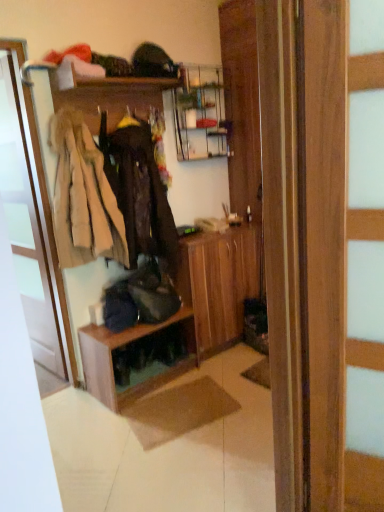
I want to click on white glossy door at left, so click(27, 227).

Identify the location of wooden dresser at center. (174, 314).

Where is `wooden shelf at center, the second shelf in the top-to-bottom sequence`? This screenshot has width=384, height=512. wooden shelf at center, the second shelf in the top-to-bottom sequence is located at coordinates (136, 358).

At what (x,y) coordinates should I click in order to perform the action: click on beige fur coat at left, placed as the 2th clothing when sorted from right to left. Please return your answer as a coordinate pair (x, y). The width and height of the screenshot is (384, 512). Looking at the image, I should click on (83, 196).

Looking at this image, is wooden dresser at center facing away from white glossy door at left?

Yes.

What are the coordinates of `door to the left of wooden dresser at center` in the screenshot? It's located at (27, 227).

From the image's perspective, is wooden dresser at center located above or below white glossy door at left?

Based on their image positions, wooden dresser at center is located beneath white glossy door at left.

Between wooden dresser at center and white glossy door at left, which one appears on the left side from the viewer's perspective?

white glossy door at left.

Based on the photo, is wooden coat rack at upper left, the 1th shelf positioned from the top, positioned with its back to white glossy door at left?

No, wooden coat rack at upper left, the 1th shelf positioned from the top, is not facing away from white glossy door at left.

Looking at this image, can we say wooden coat rack at upper left, acting as the 2th shelf starting from the bottom, lies outside white glossy door at left?

Yes, wooden coat rack at upper left, acting as the 2th shelf starting from the bottom, is outside of white glossy door at left.

Between wooden coat rack at upper left, the 1th shelf positioned from the top, and white glossy door at left, which one has more height?

Standing taller between the two is white glossy door at left.

Considering the positions of point (179, 82) and point (15, 225), is point (179, 82) closer or farther from the camera than point (15, 225)?

Point (179, 82) is positioned closer to the camera compared to point (15, 225).

From the image's perspective, is beige fur coat at left, the first clothing viewed from the left, above wooden dresser at center?

Indeed, from the image's perspective, beige fur coat at left, the first clothing viewed from the left, is shown above wooden dresser at center.

From a real-world perspective, which object stands above the other?

Result: beige fur coat at left, the first clothing viewed from the left, is physically above.

Is beige fur coat at left, the first clothing viewed from the left, not near wooden dresser at center?

That's not correct — beige fur coat at left, the first clothing viewed from the left, is a little close to wooden dresser at center.

Relative to wooden dresser at center, is beige fur coat at left, the first clothing viewed from the left, in front or behind?

In the image, beige fur coat at left, the first clothing viewed from the left, appears behind wooden dresser at center.

Considering the sizes of objects dark brown leather jacket at center, which ranks as the 1th clothing in right-to-left order, and beige fur coat at left, the first clothing viewed from the left, in the image provided, who is smaller, dark brown leather jacket at center, which ranks as the 1th clothing in right-to-left order, or beige fur coat at left, the first clothing viewed from the left,?

Smaller between the two is beige fur coat at left, the first clothing viewed from the left.

You are a GUI agent. You are given a task and a screenshot of the screen. Output one action in this format:
    pyautogui.click(x=<x>, y=<y>)
    Task: Click on the clothing located underneath the beige fur coat at left, placed as the 2th clothing when sorted from right to left (from a real-world perspective)
    The width and height of the screenshot is (384, 512).
    Given the screenshot: What is the action you would take?
    pyautogui.click(x=139, y=192)

Considering the relative sizes of dark brown leather jacket at center, which ranks as the 1th clothing in right-to-left order, and beige fur coat at left, the first clothing viewed from the left, in the image provided, is dark brown leather jacket at center, which ranks as the 1th clothing in right-to-left order, wider than beige fur coat at left, the first clothing viewed from the left,?

Yes.

From the picture: How much distance is there between white glossy door at left and beige fur coat at left, placed as the 2th clothing when sorted from right to left?

The distance of white glossy door at left from beige fur coat at left, placed as the 2th clothing when sorted from right to left, is 16.92 inches.

Considering the sizes of objects white glossy door at left and beige fur coat at left, the first clothing viewed from the left, in the image provided, who is shorter, white glossy door at left or beige fur coat at left, the first clothing viewed from the left,?

beige fur coat at left, the first clothing viewed from the left.

Which object is positioned more to the right, white glossy door at left or beige fur coat at left, placed as the 2th clothing when sorted from right to left?

beige fur coat at left, placed as the 2th clothing when sorted from right to left.

Is white glossy door at left not within beige fur coat at left, the first clothing viewed from the left?

Absolutely, white glossy door at left is external to beige fur coat at left, the first clothing viewed from the left.

Can you confirm if dark brown leather jacket at center, the second clothing when ordered from left to right, is taller than wooden coat rack at upper left, acting as the 2th shelf starting from the bottom?

Indeed, dark brown leather jacket at center, the second clothing when ordered from left to right, has a greater height compared to wooden coat rack at upper left, acting as the 2th shelf starting from the bottom.

From the image's perspective, is dark brown leather jacket at center, which ranks as the 1th clothing in right-to-left order, located above or below wooden coat rack at upper left, the 1th shelf positioned from the top?

dark brown leather jacket at center, which ranks as the 1th clothing in right-to-left order, is situated lower than wooden coat rack at upper left, the 1th shelf positioned from the top, in the image.

Is dark brown leather jacket at center, the second clothing when ordered from left to right, touching wooden coat rack at upper left, acting as the 2th shelf starting from the bottom?

No, dark brown leather jacket at center, the second clothing when ordered from left to right, is not making contact with wooden coat rack at upper left, acting as the 2th shelf starting from the bottom.

Which object is thinner, dark brown leather jacket at center, which ranks as the 1th clothing in right-to-left order, or wooden coat rack at upper left, acting as the 2th shelf starting from the bottom?

wooden coat rack at upper left, acting as the 2th shelf starting from the bottom.

Is beige fur coat at left, placed as the 2th clothing when sorted from right to left, not inside dark brown leather jacket at center, which ranks as the 1th clothing in right-to-left order?

beige fur coat at left, placed as the 2th clothing when sorted from right to left, lies outside dark brown leather jacket at center, which ranks as the 1th clothing in right-to-left order,'s area.

Based on the photo, in terms of width, does beige fur coat at left, the first clothing viewed from the left, look wider or thinner when compared to dark brown leather jacket at center, the second clothing when ordered from left to right?

In the image, beige fur coat at left, the first clothing viewed from the left, appears to be more narrow than dark brown leather jacket at center, the second clothing when ordered from left to right.

Would you consider beige fur coat at left, placed as the 2th clothing when sorted from right to left, to be distant from dark brown leather jacket at center, which ranks as the 1th clothing in right-to-left order?

No, beige fur coat at left, placed as the 2th clothing when sorted from right to left, is not far from dark brown leather jacket at center, which ranks as the 1th clothing in right-to-left order.

Identify the location of door on the left of the wooden dresser at center. The height and width of the screenshot is (512, 384). (27, 227).

At what (x,y) coordinates should I click in order to perform the action: click on door below the wooden coat rack at upper left, acting as the 2th shelf starting from the bottom (from the image's perspective). Please return your answer as a coordinate pair (x, y). Looking at the image, I should click on (27, 227).

Estimate the real-world distances between objects in this image. Which object is closer to white glossy door at left, wooden shelf at center, the 1th shelf positioned from the bottom, or beige fur coat at left, placed as the 2th clothing when sorted from right to left?

beige fur coat at left, placed as the 2th clothing when sorted from right to left, is positioned closer to the anchor white glossy door at left.

Estimate the real-world distances between objects in this image. Which object is closer to beige fur coat at left, the first clothing viewed from the left, wooden coat rack at upper left, the 1th shelf positioned from the top, or wooden dresser at center?

wooden dresser at center.

From the image, which object appears to be nearer to wooden coat rack at upper left, the 1th shelf positioned from the top, white glossy door at left or wooden shelf at center, the 1th shelf positioned from the bottom?

white glossy door at left is positioned closer to the anchor wooden coat rack at upper left, the 1th shelf positioned from the top.

When comparing their distances from wooden dresser at center, does wooden coat rack at upper left, acting as the 2th shelf starting from the bottom, or dark brown leather jacket at center, the second clothing when ordered from left to right, seem closer?

dark brown leather jacket at center, the second clothing when ordered from left to right, is positioned closer to the anchor wooden dresser at center.

When comparing their distances from wooden shelf at center, the 1th shelf positioned from the bottom, does dark brown leather jacket at center, which ranks as the 1th clothing in right-to-left order, or wooden coat rack at upper left, the 1th shelf positioned from the top, seem closer?

Among the two, dark brown leather jacket at center, which ranks as the 1th clothing in right-to-left order, is located nearer to wooden shelf at center, the 1th shelf positioned from the bottom.

When comparing their distances from beige fur coat at left, the first clothing viewed from the left, does wooden dresser at center or wooden shelf at center, the second shelf in the top-to-bottom sequence, seem further?

wooden shelf at center, the second shelf in the top-to-bottom sequence.

Based on their spatial positions, is beige fur coat at left, placed as the 2th clothing when sorted from right to left, or wooden shelf at center, the second shelf in the top-to-bottom sequence, closer to wooden coat rack at upper left, acting as the 2th shelf starting from the bottom?

beige fur coat at left, placed as the 2th clothing when sorted from right to left, is closer to wooden coat rack at upper left, acting as the 2th shelf starting from the bottom.

From the image, which object appears to be farther from wooden dresser at center, beige fur coat at left, placed as the 2th clothing when sorted from right to left, or white glossy door at left?

Among the two, white glossy door at left is located further to wooden dresser at center.

You are a GUI agent. You are given a task and a screenshot of the screen. Output one action in this format:
    pyautogui.click(x=<x>, y=<y>)
    Task: Click on the shelf between wooden dresser at center and dark brown leather jacket at center, the second clothing when ordered from left to right, along the z-axis
    
    Given the screenshot: What is the action you would take?
    pyautogui.click(x=107, y=95)

At what (x,y) coordinates should I click in order to perform the action: click on door located between wooden dresser at center and beige fur coat at left, placed as the 2th clothing when sorted from right to left, in the depth direction. Please return your answer as a coordinate pair (x, y). The image size is (384, 512). Looking at the image, I should click on (27, 227).

Find the location of a particular element. Image resolution: width=384 pixels, height=512 pixels. door between wooden dresser at center and wooden shelf at center, the 1th shelf positioned from the bottom, along the z-axis is located at coordinates (27, 227).

Where is `door between wooden coat rack at upper left, acting as the 2th shelf starting from the bottom, and wooden shelf at center, the 1th shelf positioned from the bottom, from top to bottom`? This screenshot has width=384, height=512. door between wooden coat rack at upper left, acting as the 2th shelf starting from the bottom, and wooden shelf at center, the 1th shelf positioned from the bottom, from top to bottom is located at coordinates (27, 227).